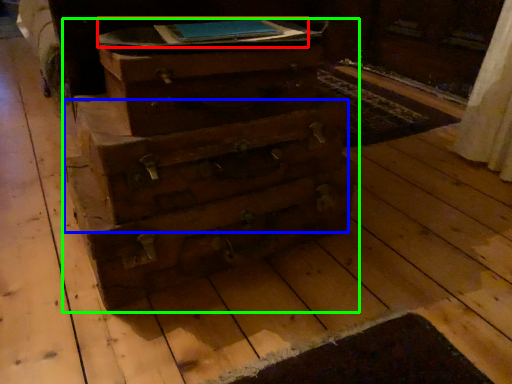
Question: Which is nearer to the book (highlighted by a red box)? drawer (highlighted by a blue box) or chest of drawers (highlighted by a green box).

Choices:
 (A) drawer
 (B) chest of drawers

Answer: (B)